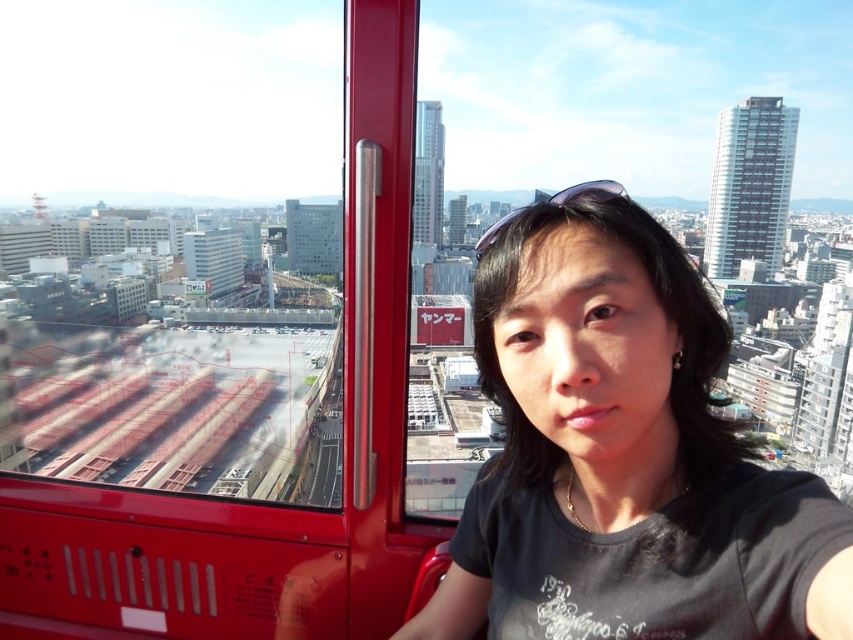
Question: Is transparent glass window at upper center below black matte shirt at center?

Choices:
 (A) yes
 (B) no

Answer: (B)

Question: Can you confirm if transparent glass window at upper center is positioned below black matte shirt at center?

Choices:
 (A) yes
 (B) no

Answer: (B)

Question: Which object appears farthest from the camera in this image?

Choices:
 (A) black matte shirt at center
 (B) transparent glass window at upper center

Answer: (B)

Question: Can you confirm if transparent glass window at upper center is positioned below black matte shirt at center?

Choices:
 (A) no
 (B) yes

Answer: (A)